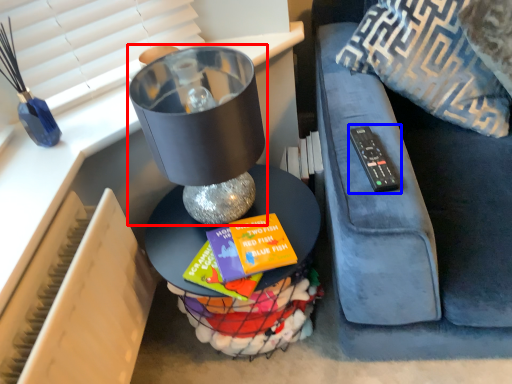
Question: Which point is closer to the camera, table lamp (highlighted by a red box) or remote (highlighted by a blue box)?

Choices:
 (A) table lamp
 (B) remote

Answer: (A)